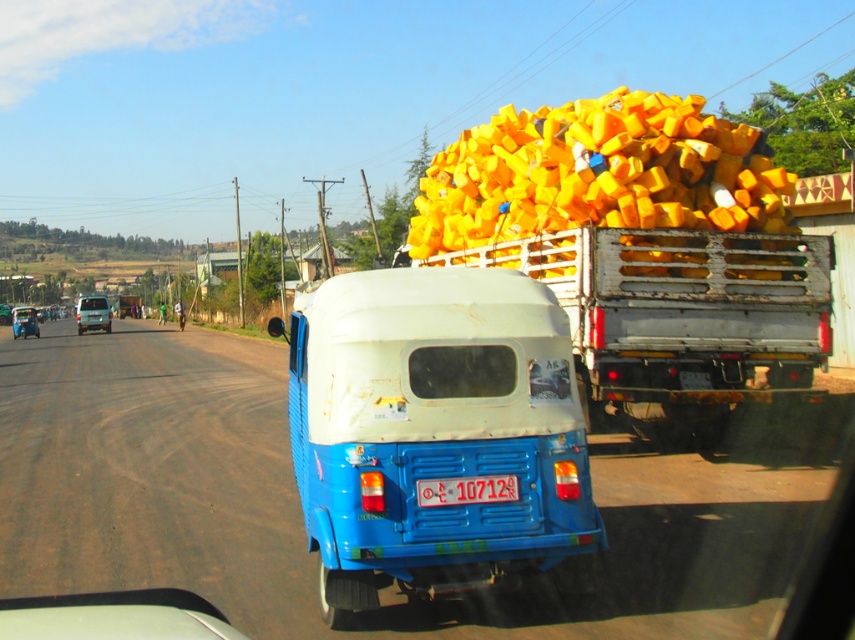
You are standing at the center of the rural road and see the rusty metal truck at right. Can you determine if the truck is positioned to the left or right side of the road based on its coordinates?

The rusty metal truck at right is located at point [680,317], which places it on the right side of the road since its x coordinate is closer to 1.0 on the right side of the image.

You are a delivery driver needing to pass a narrow bridge ahead. You see the white matte auto rickshaw at center and the rusty metal truck at right. Which vehicle should you avoid passing if the bridge is too narrow?

The rusty metal truck at right has a greater width than the white matte auto rickshaw at center, so you should avoid passing the rusty metal truck at right on the narrow bridge.

You are a pedestrian standing on the side of the rural road. You see the rusty metal truck at right and the white plastic license plate at rear. Which object is positioned higher from the ground?

The rusty metal truck at right is above the white plastic license plate at rear, so the rusty metal truck at right is higher from the ground.